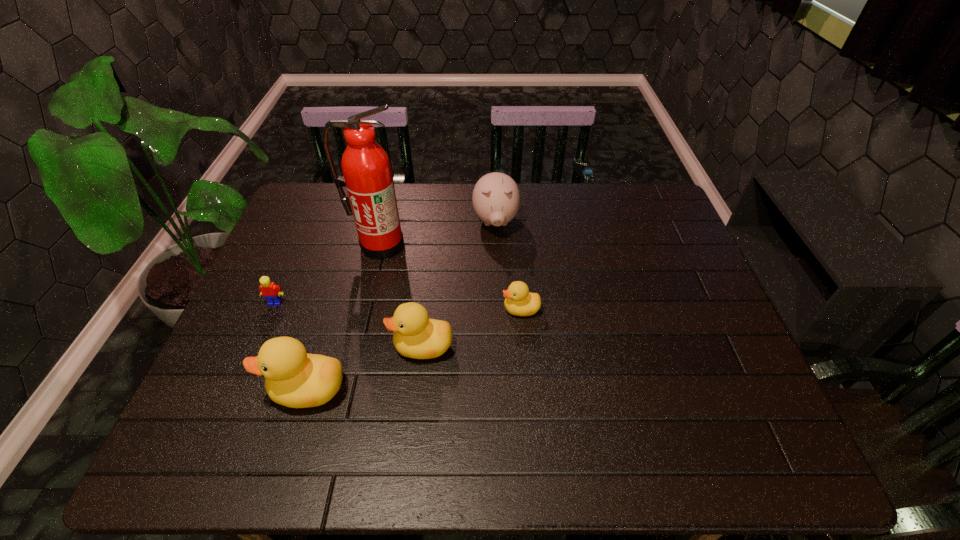
Where is `vacant space positioned 0.130m on the face of the nearest duckling`? vacant space positioned 0.130m on the face of the nearest duckling is located at coordinates (210, 389).

At what (x,y) coordinates should I click in order to perform the action: click on free region located on the face of the nearest duckling. Please return your answer as a coordinate pair (x, y). This screenshot has width=960, height=540. Looking at the image, I should click on (219, 389).

The height and width of the screenshot is (540, 960). Identify the location of vacant region located 0.280m on the face of the second nearest object. (276, 346).

Image resolution: width=960 pixels, height=540 pixels. In order to click on vacant region located 0.170m on the face of the second nearest object in this screenshot , I will do `click(321, 346)`.

Image resolution: width=960 pixels, height=540 pixels. Identify the location of vacant space located on the face of the second nearest object. (337, 346).

Identify the location of vacant space situated 0.070m on the face of the farthest duckling. (475, 309).

The width and height of the screenshot is (960, 540). I want to click on vacant area situated on the face of the farthest duckling, so click(483, 309).

You are a GUI agent. You are given a task and a screenshot of the screen. Output one action in this format:
    pyautogui.click(x=<x>, y=<y>)
    Task: Click on the vacant space positioned on the face of the farthest duckling
    The image size is (960, 540).
    Given the screenshot: What is the action you would take?
    pyautogui.click(x=475, y=309)

Locate an element on the screen. free region located on the label side of the tallest object is located at coordinates (365, 307).

This screenshot has width=960, height=540. Identify the location of vacant space located 0.080m at the snout of the piggy bank. (497, 260).